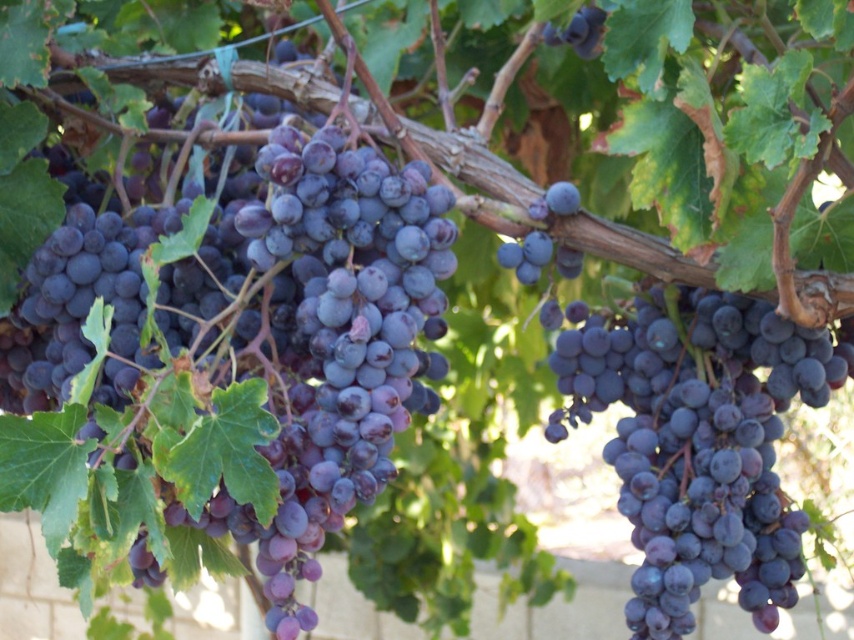
Question: Which point is farther to the camera?

Choices:
 (A) (574, 19)
 (B) (137, 348)
 (C) (775, 595)

Answer: (A)

Question: Which object is closer to the camera taking this photo?

Choices:
 (A) purple matte grapes at center
 (B) shiny dark purple grapes at center
 (C) dark purple grape at upper right

Answer: (A)

Question: Which of the following is the farthest from the observer?

Choices:
 (A) purple matte grapes at center
 (B) dark purple grape at upper right

Answer: (B)

Question: Does purple matte grapes at center have a smaller size compared to dark purple grape at upper right?

Choices:
 (A) yes
 (B) no

Answer: (B)

Question: Is purple matte grapes at center smaller than shiny dark purple grapes at center?

Choices:
 (A) no
 (B) yes

Answer: (A)

Question: Does purple matte grapes at center have a larger size compared to dark purple grape at upper right?

Choices:
 (A) yes
 (B) no

Answer: (A)